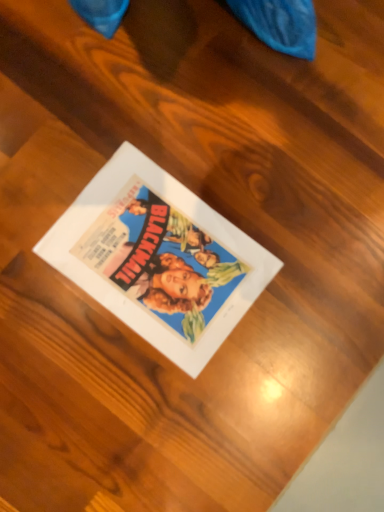
Where is `vacant location below matte paper poster at center (from a real-world perspective)`? This screenshot has height=512, width=384. vacant location below matte paper poster at center (from a real-world perspective) is located at coordinates pos(162,260).